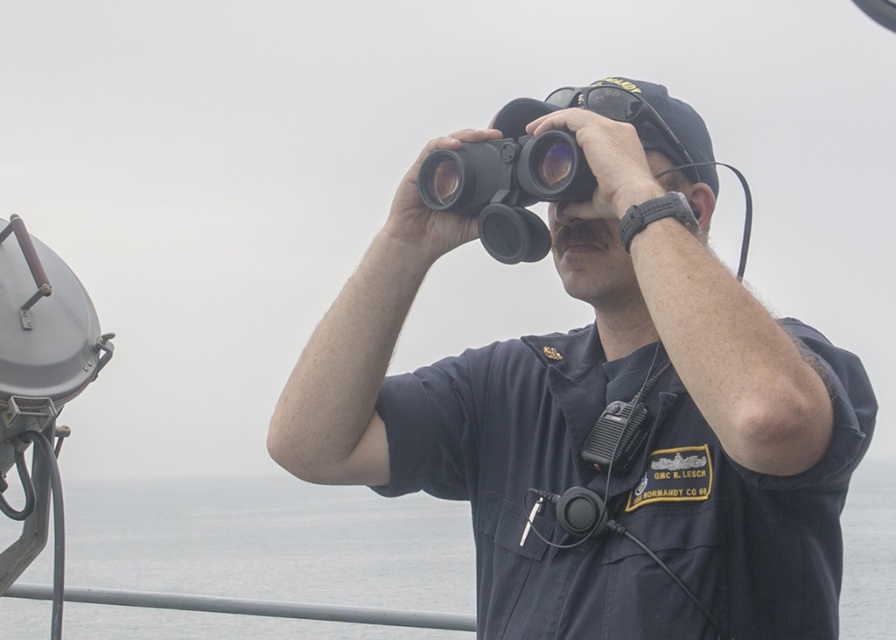
How far apart are the black matte binoculars at center and the communication device clipped to the uniform?

The black matte binoculars at center and the communication device clipped to the uniform are 5.53 meters apart.

The scene depicts a person in a navy blue uniform holding binoculars and observing gray water. Where is the black matte binoculars at center located relative to the gray water at center?

The black matte binoculars at center is to the right of gray water at center according to the description.